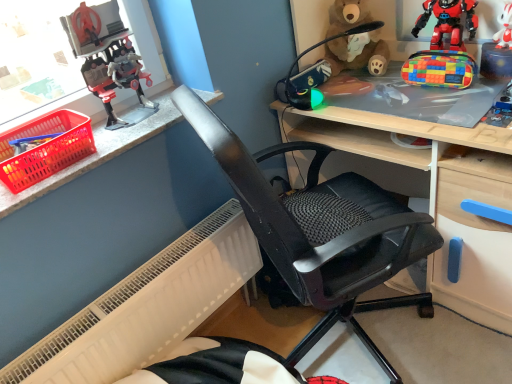
Image resolution: width=512 pixels, height=384 pixels. What are the coordinates of `free space on the front side of plastic robot at upper left, the first toy from the left` in the screenshot? It's located at (133, 137).